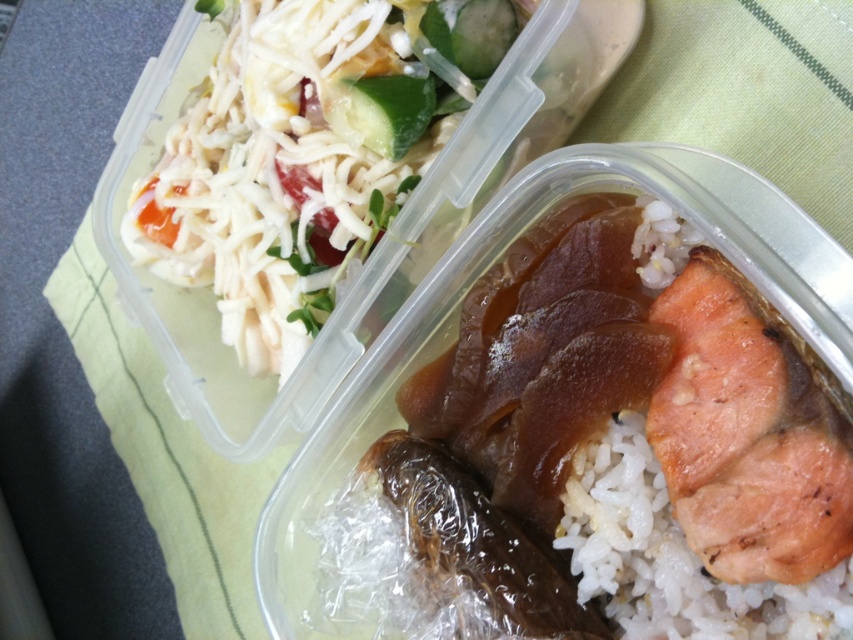
Based on the photo, does pinkish-brown flaky salmon at right have a larger size compared to green crisp cucumber at upper center?

Indeed, pinkish-brown flaky salmon at right has a larger size compared to green crisp cucumber at upper center.

Describe the element at coordinates (747, 435) in the screenshot. I see `pinkish-brown flaky salmon at right` at that location.

You are a GUI agent. You are given a task and a screenshot of the screen. Output one action in this format:
    pyautogui.click(x=<x>, y=<y>)
    Task: Click on the pinkish-brown flaky salmon at right
    
    Given the screenshot: What is the action you would take?
    coord(747,435)

Find the location of a particular element. The image size is (853, 640). pinkish-brown flaky salmon at right is located at coordinates 747,435.

Who is shorter, white matte rice at lower right or green crisp cucumber at upper center?

green crisp cucumber at upper center

How much distance is there between white matte rice at lower right and green crisp cucumber at upper center?

white matte rice at lower right and green crisp cucumber at upper center are 16.99 inches apart from each other.

Is point (648, 637) farther from camera compared to point (402, 104)?

No, (648, 637) is closer to viewer.

Where is `white matte rice at lower right`? white matte rice at lower right is located at coordinates pos(672,556).

Does point (366, 99) come behind point (654, 227)?

Yes, point (366, 99) is behind point (654, 227).

Who is more distant from viewer, (300,172) or (648,205)?

The point (300,172) is more distant.

At what (x,y) coordinates should I click in order to perform the action: click on white shredded cheese at upper left. Please return your answer as a coordinate pair (x, y). The width and height of the screenshot is (853, 640). Looking at the image, I should click on (303, 156).